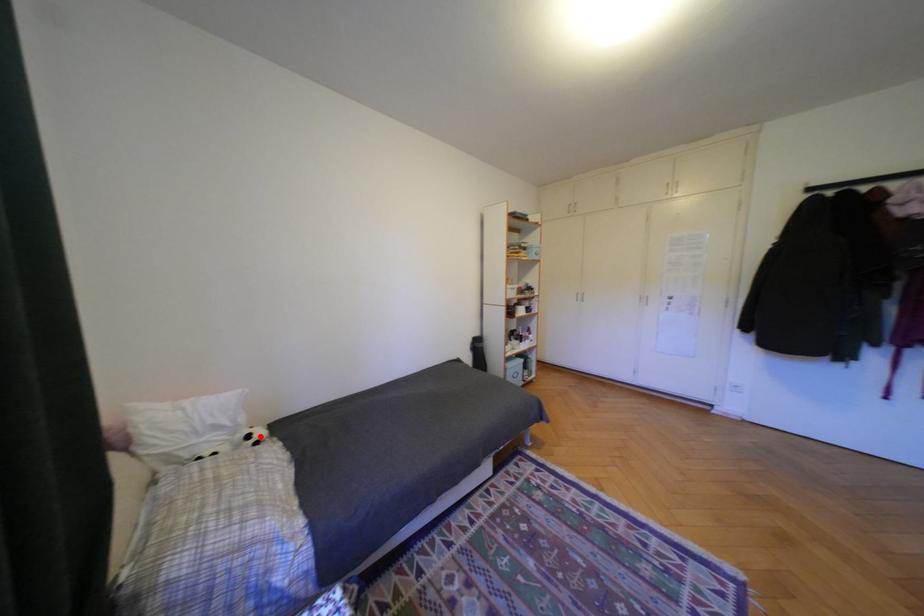
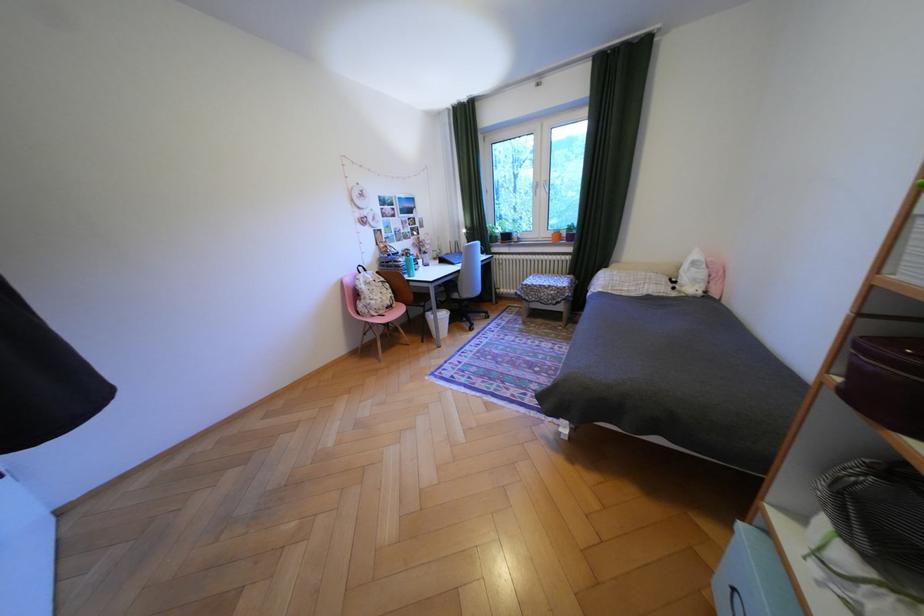
Find the pixel in the second image that matches the highlighted location in the first image.

(687, 282)